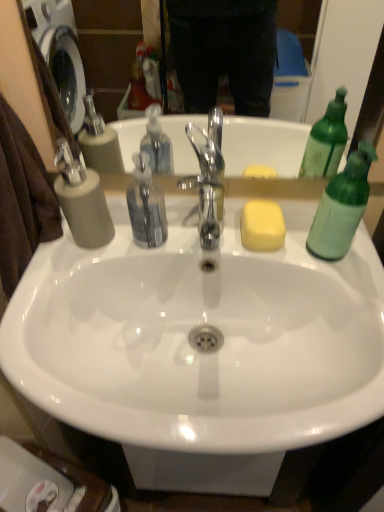
Question: From the image's perspective, does white glossy sink at center appear lower than green translucent bottle at right?

Choices:
 (A) no
 (B) yes

Answer: (B)

Question: Is the position of white glossy sink at center less distant than that of green translucent bottle at right?

Choices:
 (A) no
 (B) yes

Answer: (B)

Question: Can you confirm if white glossy sink at center is taller than green translucent bottle at right?

Choices:
 (A) no
 (B) yes

Answer: (B)

Question: Is white glossy sink at center located outside green translucent bottle at right?

Choices:
 (A) no
 (B) yes

Answer: (B)

Question: Can you confirm if white glossy sink at center is positioned to the right of green translucent bottle at right?

Choices:
 (A) yes
 (B) no

Answer: (B)

Question: Considering the relative positions of white glossy sink at center and green translucent bottle at right in the image provided, is white glossy sink at center to the left of green translucent bottle at right from the viewer's perspective?

Choices:
 (A) no
 (B) yes

Answer: (B)

Question: Is matte gray soap dispenser at left positioned beyond the bounds of green translucent bottle at right?

Choices:
 (A) no
 (B) yes

Answer: (B)

Question: Is the depth of matte gray soap dispenser at left greater than that of green translucent bottle at right?

Choices:
 (A) no
 (B) yes

Answer: (B)

Question: Does matte gray soap dispenser at left appear on the right side of green translucent bottle at right?

Choices:
 (A) yes
 (B) no

Answer: (B)

Question: From the image's perspective, is matte gray soap dispenser at left on top of green translucent bottle at right?

Choices:
 (A) yes
 (B) no

Answer: (A)

Question: Is green translucent bottle at right at the back of matte gray soap dispenser at left?

Choices:
 (A) no
 (B) yes

Answer: (A)

Question: Are matte gray soap dispenser at left and green translucent bottle at right located far from each other?

Choices:
 (A) no
 (B) yes

Answer: (A)

Question: From the image's perspective, is green translucent bottle at right over white glossy sink at center?

Choices:
 (A) no
 (B) yes

Answer: (B)